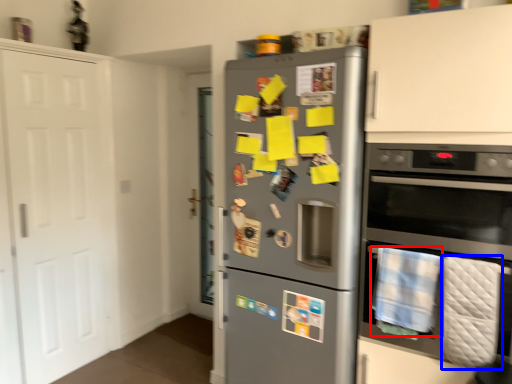
Question: Which object appears farthest to the camera in this image, blanket (highlighted by a red box) or blanket (highlighted by a blue box)?

Choices:
 (A) blanket
 (B) blanket

Answer: (A)